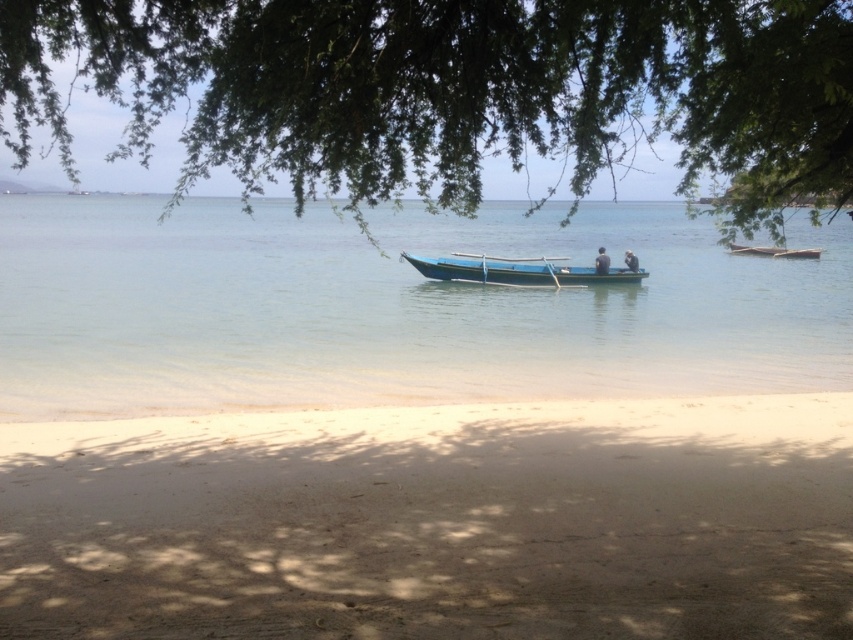
Which of these two, blue wooden boat at center or dark blue fabric at center, stands shorter?

dark blue fabric at center is shorter.

Does point (425, 266) come behind point (595, 273)?

That is False.

Locate an element on the screen. blue wooden boat at center is located at coordinates (515, 269).

Is point (605, 259) positioned in front of point (624, 259)?

Yes.

Based on the photo, does dark blue fabric at center appear on the right side of smooth skin person at center?

No, dark blue fabric at center is not to the right of smooth skin person at center.

Who is more forward, (x=604, y=262) or (x=627, y=264)?

Positioned in front is point (x=604, y=262).

The width and height of the screenshot is (853, 640). I want to click on dark blue fabric at center, so click(601, 260).

Can you confirm if white sandy beach at lower center is bigger than dark blue fabric at center?

No.

Which is in front, point (697, 493) or point (596, 259)?

Point (697, 493)

Image resolution: width=853 pixels, height=640 pixels. I want to click on white sandy beach at lower center, so click(x=434, y=522).

Locate an element on the screen. Image resolution: width=853 pixels, height=640 pixels. white sandy beach at lower center is located at coordinates (434, 522).